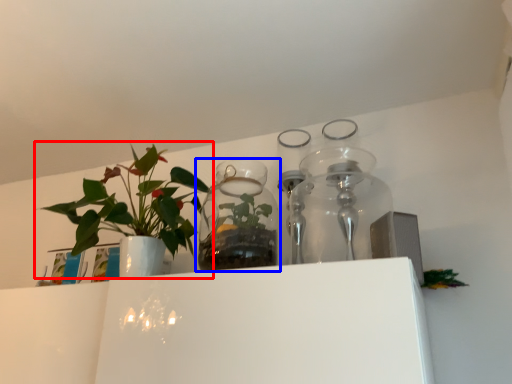
Question: Which of the following is the closest to the observer, houseplant (highlighted by a red box) or vase (highlighted by a blue box)?

Choices:
 (A) houseplant
 (B) vase

Answer: (A)